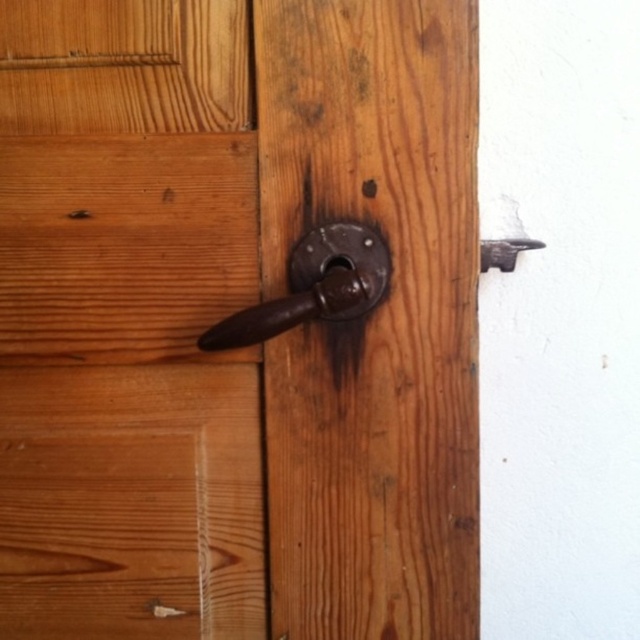
The image size is (640, 640). What do you see at coordinates (314, 285) in the screenshot?
I see `polished dark brown handle at center` at bounding box center [314, 285].

Does polished dark brown handle at center have a smaller size compared to rusty metal door handle at upper right?

No, polished dark brown handle at center is not smaller than rusty metal door handle at upper right.

This screenshot has width=640, height=640. Describe the element at coordinates (314, 285) in the screenshot. I see `polished dark brown handle at center` at that location.

What are the coordinates of `polished dark brown handle at center` in the screenshot? It's located at (314, 285).